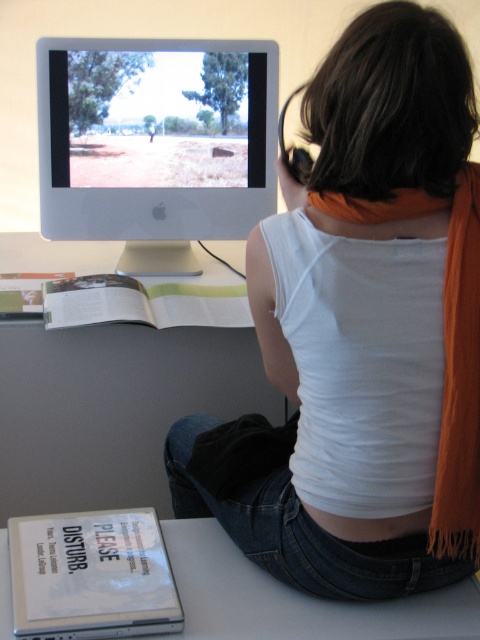
You are an assistant who needs to deliver a document to the person sitting at the desk. The document is placed on the white paper at lower left. The person is wearing the white matte tank top at center. To hand them the document without disturbing them, should you approach from above or below their current position?

The white matte tank top at center is above the white paper at lower left, so you should approach from below their current position to hand them the document without disturbing them.